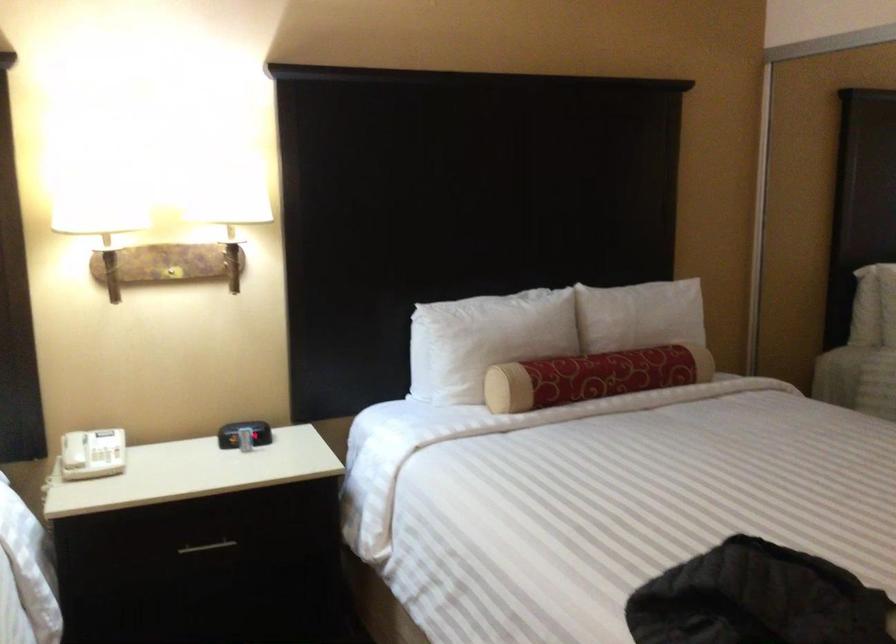
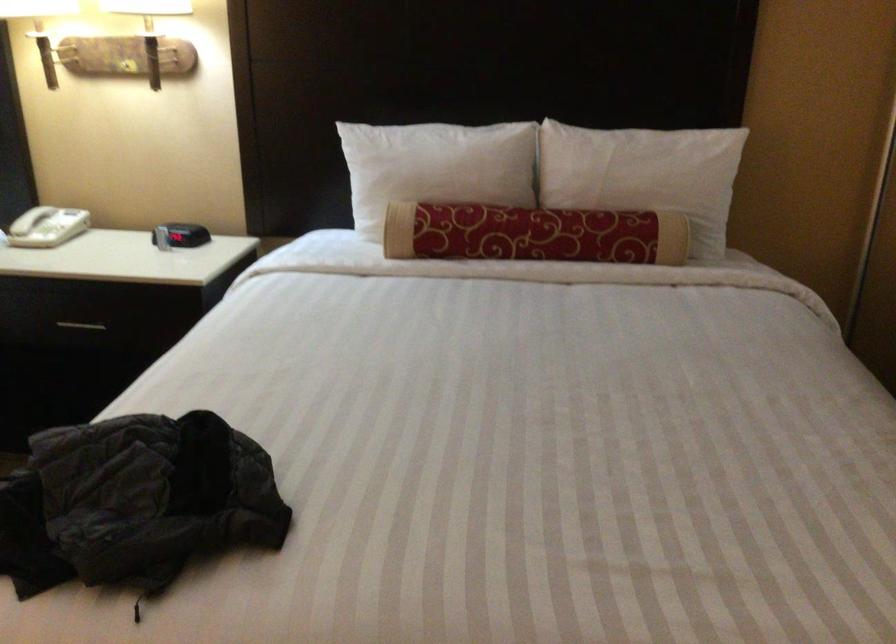
Find the pixel in the second image that matches (x=621, y=372) in the first image.

(533, 234)